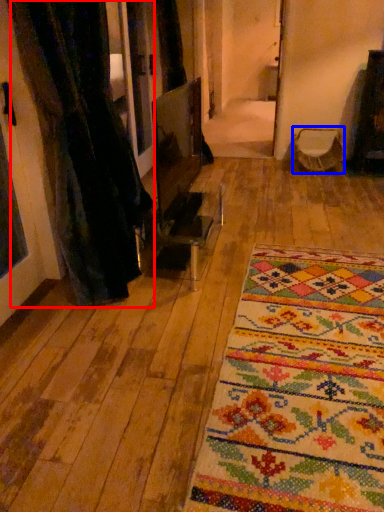
Question: Which of the following is the closest to the observer, curtain (highlighted by a red box) or armchair (highlighted by a blue box)?

Choices:
 (A) curtain
 (B) armchair

Answer: (A)